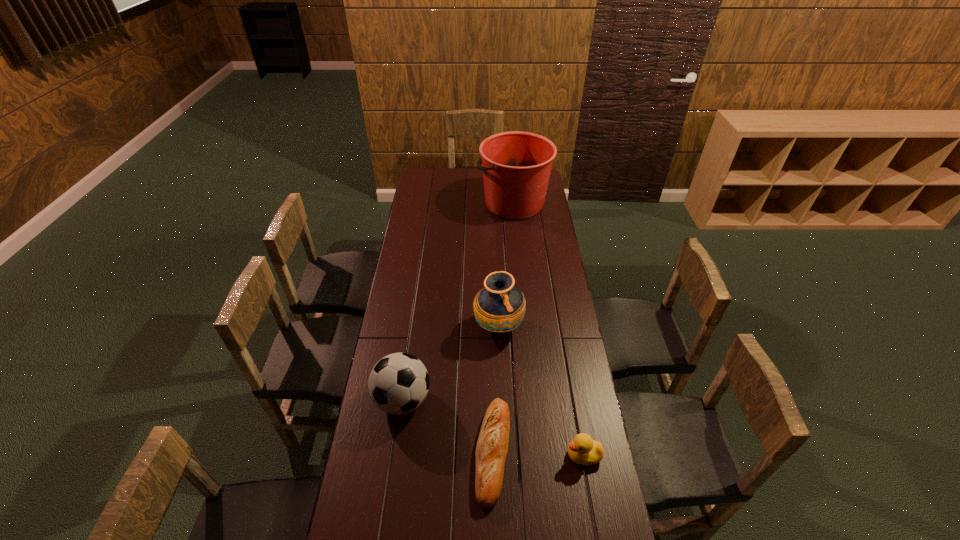
You are a GUI agent. You are given a task and a screenshot of the screen. Output one action in this format:
    pyautogui.click(x=<x>, y=<y>)
    Task: Click on the free location at the left edge of the desktop
    The image size is (960, 540).
    Given the screenshot: What is the action you would take?
    pyautogui.click(x=435, y=189)

Where is `blank area at the right edge`? blank area at the right edge is located at coordinates (541, 333).

In the image, there is a desktop. At what (x,y) coordinates should I click in order to perform the action: click on vacant space at the far left corner. Please return your answer as a coordinate pair (x, y). The height and width of the screenshot is (540, 960). Looking at the image, I should click on [x=438, y=185].

The image size is (960, 540). I want to click on vacant area that lies between the pottery and the duck, so click(540, 391).

Where is `free space between the second farthest object and the bucket`? This screenshot has height=540, width=960. free space between the second farthest object and the bucket is located at coordinates (506, 265).

This screenshot has width=960, height=540. In order to click on empty space that is in between the fourth tallest object and the baguet in this screenshot , I will do `click(539, 454)`.

Where is `blank region between the baguet and the second shortest object`? This screenshot has width=960, height=540. blank region between the baguet and the second shortest object is located at coordinates (539, 454).

In order to click on empty space that is in between the bucket and the fourth tallest object in this screenshot , I will do `click(548, 329)`.

Identify the location of vacant region between the fourth tallest object and the farthest object. This screenshot has width=960, height=540. (548, 329).

Where is `free space between the baguet and the second farthest object`? free space between the baguet and the second farthest object is located at coordinates (496, 389).